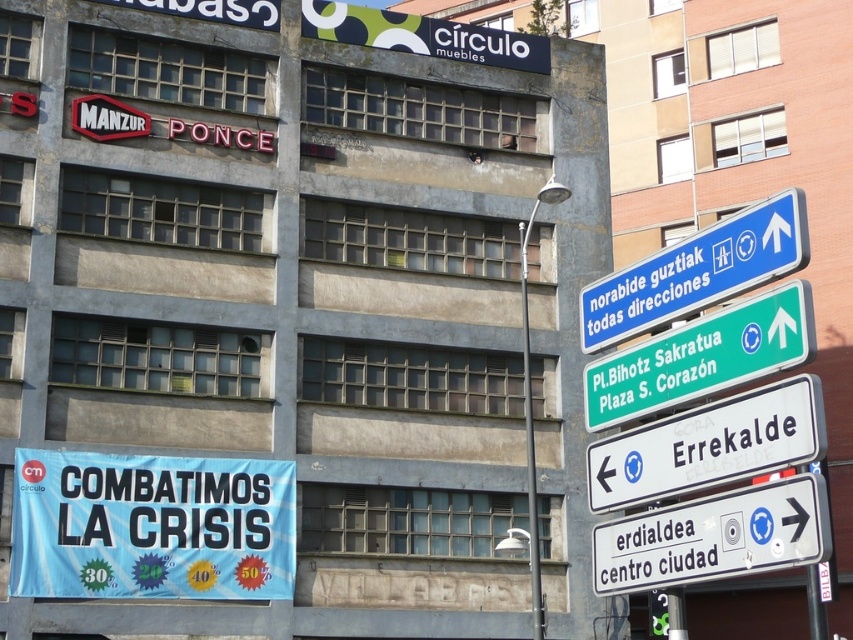
You are standing in front of the building and want to know which of the two points, point (677, 528) or point (706, 339), is closer to you. Can you determine this based on their positions?

Point (706, 339) is closer to you because it is less further to the camera than point (677, 528).

You are a delivery person trying to park your van between the white plastic sign at center right and the blue plastic sign at upper center. The van requires 4 meters of space. Can you fit the van between them?

The distance between the white plastic sign at center right and the blue plastic sign at upper center is 3.32 meters, which is less than the required 4 meters. Therefore, the van cannot fit between them.

From the picture: You are a delivery person trying to locate the banner for a promotional event. According to the image, where exactly is the light blue fabric banner at lower left located?

The light blue fabric banner at lower left is located at point (151,525).